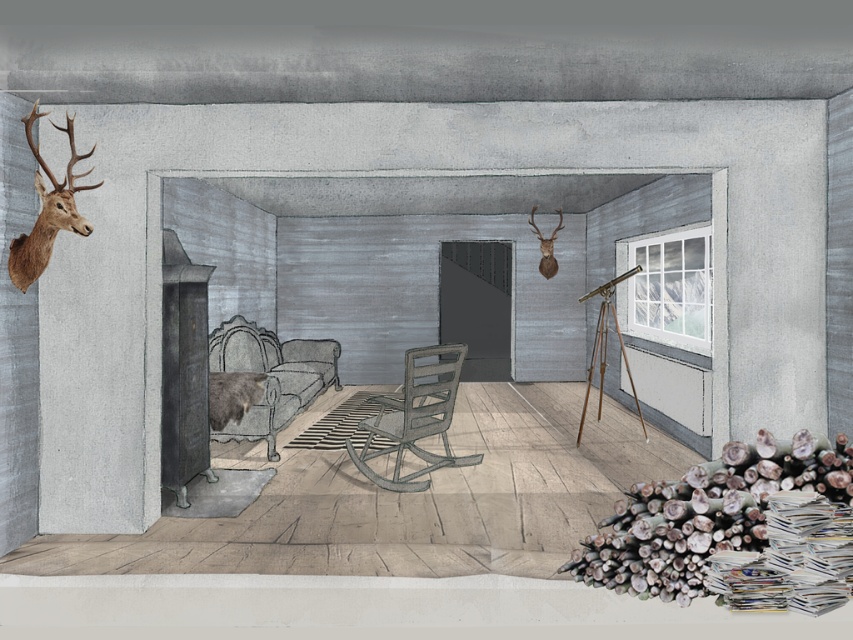
Question: Which of the following is the farthest from the observer?

Choices:
 (A) (99, 182)
 (B) (546, 250)

Answer: (B)

Question: Among these objects, which one is farthest from the camera?

Choices:
 (A) fuzzy brown bear at center
 (B) brown textured deer head at upper left

Answer: (A)

Question: Does metallic gray rocking chair at center appear on the left side of fuzzy brown bear at center?

Choices:
 (A) yes
 (B) no

Answer: (B)

Question: Can you confirm if metallic gray rocking chair at center is smaller than fuzzy brown bear at center?

Choices:
 (A) yes
 (B) no

Answer: (B)

Question: Is the position of gray fabric rocking chair at center less distant than that of fuzzy brown bear at center?

Choices:
 (A) no
 (B) yes

Answer: (A)

Question: Among these points, which one is farthest from the camera?

Choices:
 (A) (544, 248)
 (B) (415, 390)
 (C) (225, 385)

Answer: (A)